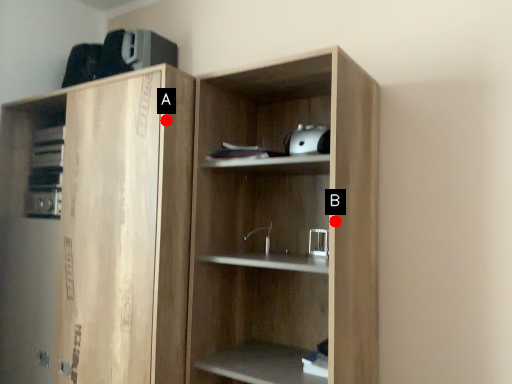
Question: Two points are circled on the image, labeled by A and B beside each circle. Among these points, which one is nearest to the camera?

Choices:
 (A) A is closer
 (B) B is closer

Answer: (B)